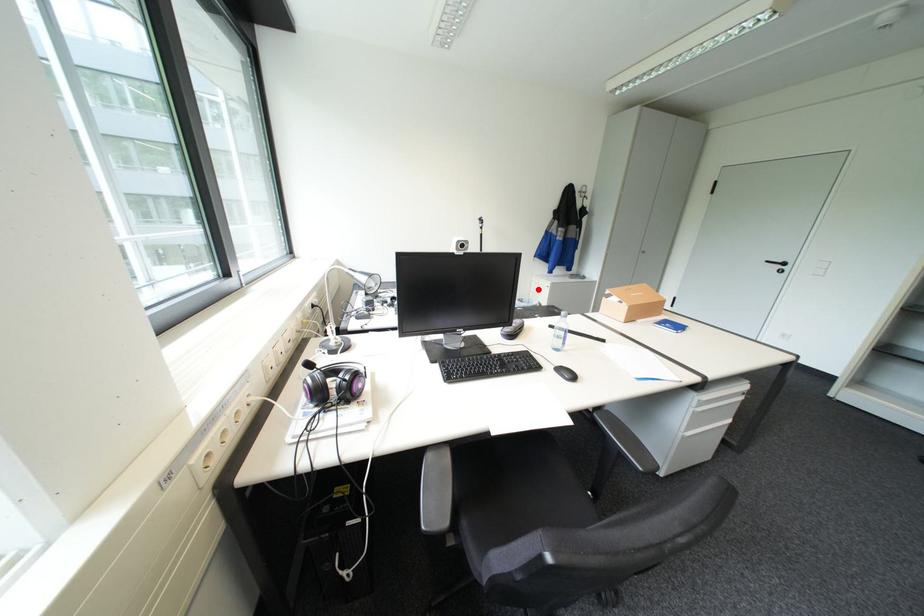
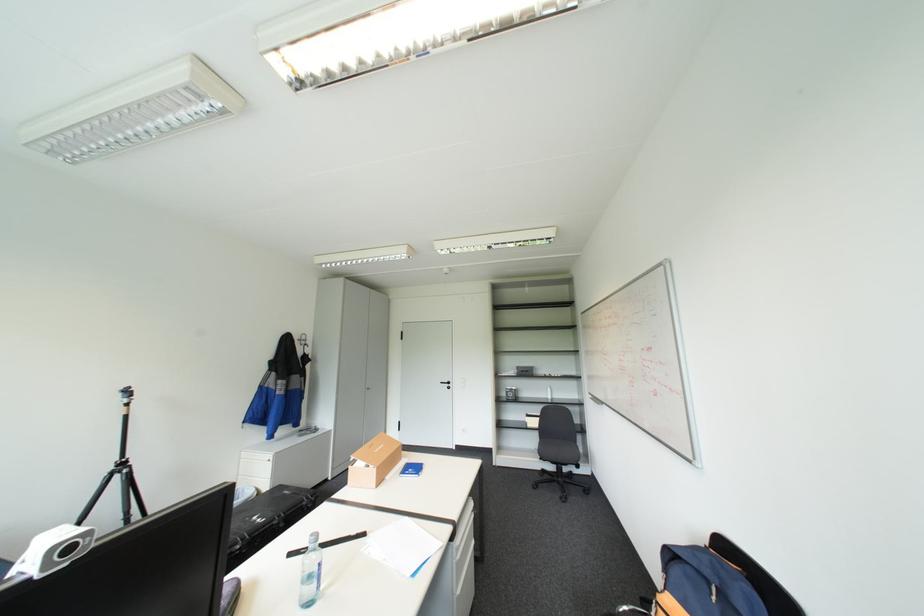
The point at the highlighted location is marked in the first image. Where is the corresponding point in the second image?

(246, 474)